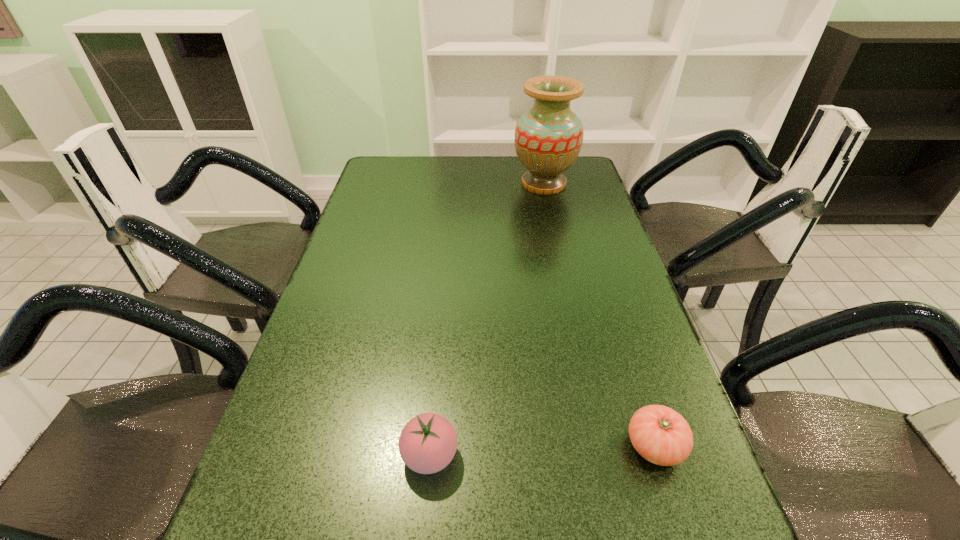
The width and height of the screenshot is (960, 540). I want to click on tomato positioned at the right edge, so click(x=662, y=436).

Locate an element on the screen. object that is at the far right corner is located at coordinates (548, 138).

The height and width of the screenshot is (540, 960). What are the coordinates of `free point at the far edge` in the screenshot? It's located at (440, 163).

In order to click on vacant space at the left edge of the desktop in this screenshot , I will do `click(376, 282)`.

In order to click on vacant space at the right edge of the desktop in this screenshot , I will do `click(576, 245)`.

Locate an element on the screen. free space at the far left corner of the desktop is located at coordinates (366, 186).

In order to click on free spot between the left tomato and the shorter tomato in this screenshot , I will do `click(542, 450)`.

The height and width of the screenshot is (540, 960). Find the location of `free space that is in between the leftmost object and the right tomato`. free space that is in between the leftmost object and the right tomato is located at coordinates (542, 450).

Image resolution: width=960 pixels, height=540 pixels. In order to click on empty space that is in between the tallest object and the left tomato in this screenshot , I will do `click(487, 320)`.

Image resolution: width=960 pixels, height=540 pixels. In order to click on empty location between the right tomato and the leftmost object in this screenshot , I will do `click(542, 450)`.